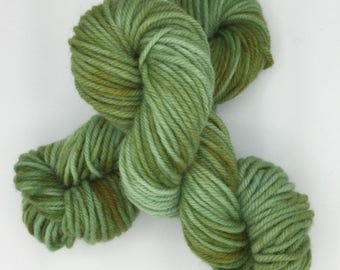
At what (x,y) coordinates should I click in order to perform the action: click on wall. Please return your answer as a coordinate pair (x, y). Looking at the image, I should click on click(268, 140).